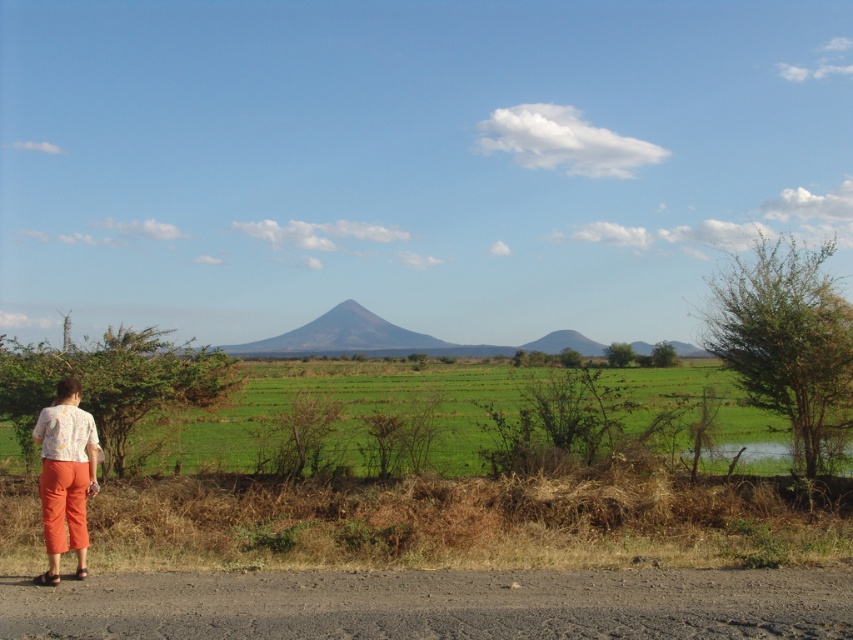
Which is more to the left, green grassy field at center or floral fabric blouse at lower left?

floral fabric blouse at lower left

Is point (722, 396) positioned before point (68, 531)?

No, (722, 396) is behind (68, 531).

Where is `green grassy field at center`? green grassy field at center is located at coordinates (430, 420).